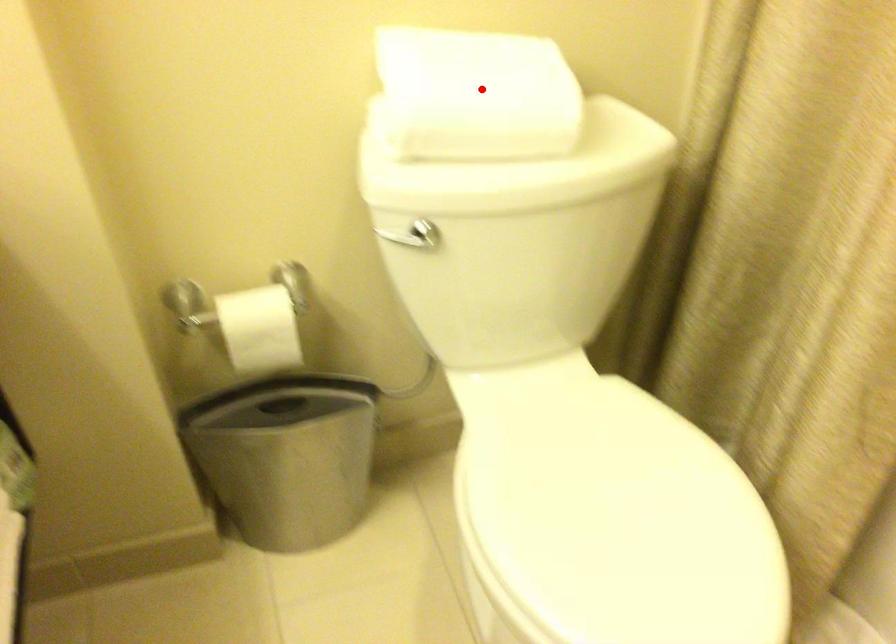
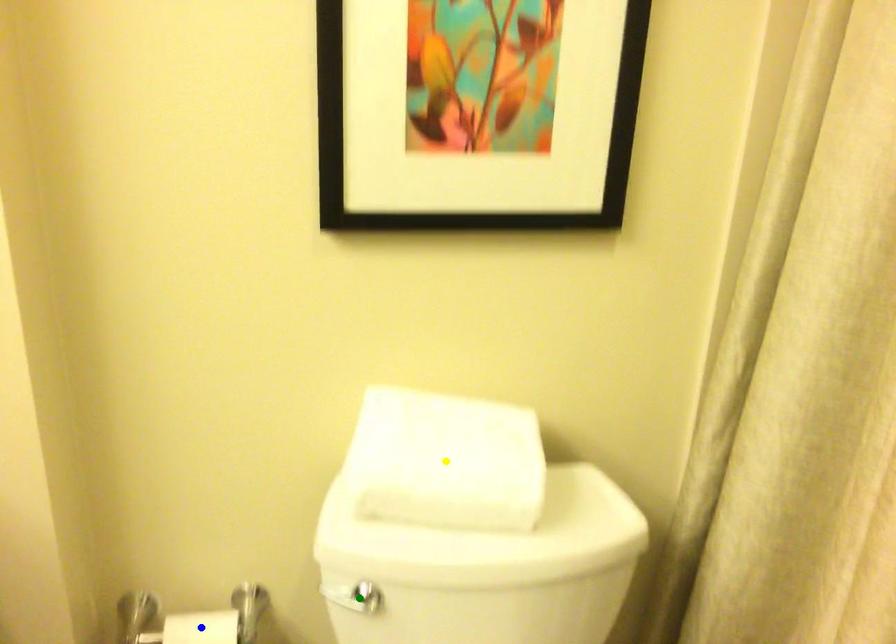
Question: I am providing you with two images of the same scene from different viewpoints. A red point is marked on the first image. You are given multiple points on the second image. Which spot in image 2 lines up with the point in image 1?

Choices:
 (A) green point
 (B) blue point
 (C) yellow point

Answer: (C)